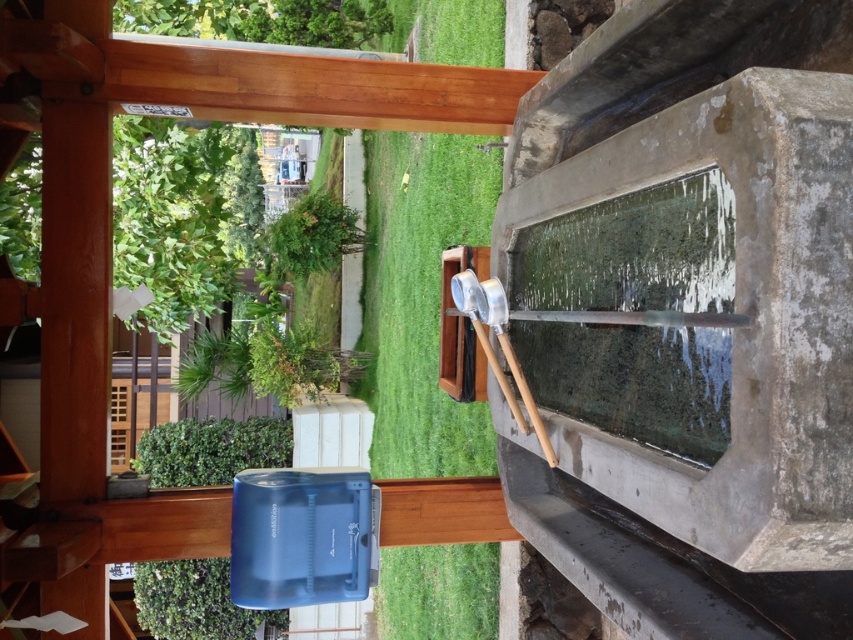
Is point (187, 627) less distant than point (317, 272)?

Yes, point (187, 627) is closer to viewer.

The width and height of the screenshot is (853, 640). What do you see at coordinates (212, 449) in the screenshot?
I see `blue plastic plant at lower left` at bounding box center [212, 449].

Find the location of a particular element. blue plastic plant at lower left is located at coordinates (212, 449).

Is green grass at center smaller than blue plastic plant at lower left?

Indeed, green grass at center has a smaller size compared to blue plastic plant at lower left.

Does green grass at center appear on the left side of blue plastic plant at lower left?

Incorrect, green grass at center is not on the left side of blue plastic plant at lower left.

Does point (463, 212) lie behind point (236, 428)?

No, it is not.

Identify the location of green grass at center. The image size is (853, 640). (421, 298).

Does point (468, 436) come in front of point (345, 216)?

Yes, it is.

Which of these two, green grass at center or green leafy plant at upper center, stands shorter?

green grass at center

Where is `green grass at center`? The height and width of the screenshot is (640, 853). green grass at center is located at coordinates (421, 298).